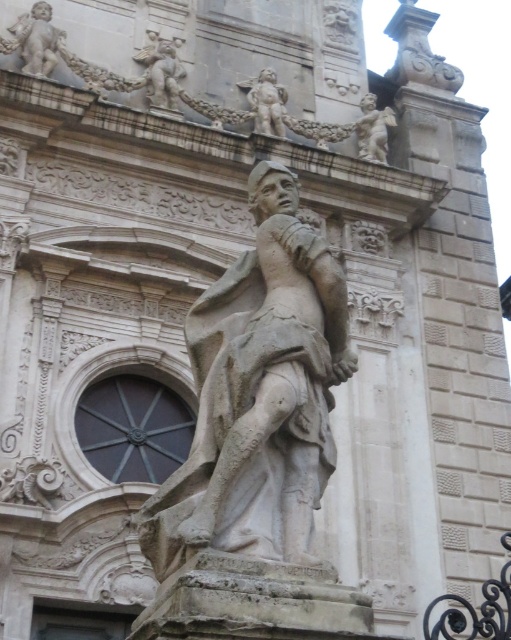
Can you confirm if polished stone cherub at upper right is shorter than stone statue at upper center?

Yes, polished stone cherub at upper right is shorter than stone statue at upper center.

Between polished stone cherub at upper right and stone statue at upper center, which one has less height?

With less height is polished stone cherub at upper right.

Where is `polished stone cherub at upper right`? The image size is (511, 640). polished stone cherub at upper right is located at coordinates (374, 129).

Does stone statue at center appear on the left side of stone statue at upper center?

Yes, stone statue at center is to the left of stone statue at upper center.

Is stone statue at center bigger than stone statue at upper center?

Yes.

This screenshot has height=640, width=511. What do you see at coordinates (259, 394) in the screenshot?
I see `stone statue at center` at bounding box center [259, 394].

Locate an element on the screen. The height and width of the screenshot is (640, 511). stone statue at center is located at coordinates (259, 394).

Does stone statue at center appear on the left side of smooth stone cherub at upper left?

No, stone statue at center is not to the left of smooth stone cherub at upper left.

Does stone statue at center have a lesser width compared to smooth stone cherub at upper left?

Incorrect, stone statue at center's width is not less than smooth stone cherub at upper left's.

Identify the location of stone statue at center. The image size is (511, 640). (259, 394).

You are a GUI agent. You are given a task and a screenshot of the screen. Output one action in this format:
    pyautogui.click(x=<x>, y=<y>)
    Task: Click on the stone statue at center
    
    Given the screenshot: What is the action you would take?
    pyautogui.click(x=259, y=394)